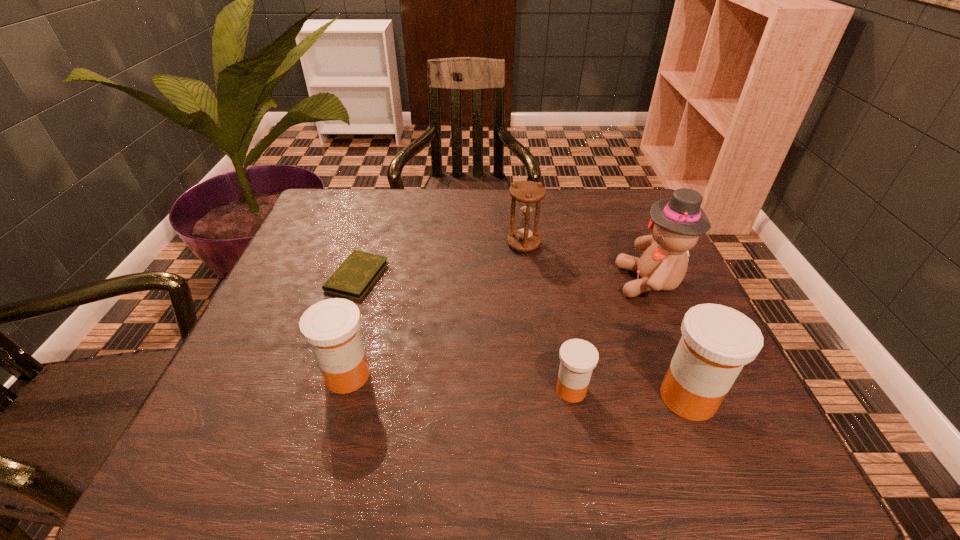
You are a GUI agent. You are given a task and a screenshot of the screen. Output one action in this format:
    pyautogui.click(x=<x>, y=<y>)
    Task: Click on the vacant space that's between the second medicine from left to right and the farthest object
    Image resolution: width=960 pixels, height=540 pixels.
    Given the screenshot: What is the action you would take?
    pyautogui.click(x=547, y=317)

You are a GUI agent. You are given a task and a screenshot of the screen. Output one action in this format:
    pyautogui.click(x=<x>, y=<y>)
    Task: Click on the free spot between the rightmost medicine and the diary
    This screenshot has width=960, height=540.
    Given the screenshot: What is the action you would take?
    pyautogui.click(x=522, y=337)

Where is `free space between the tallest object and the diary`? This screenshot has height=540, width=960. free space between the tallest object and the diary is located at coordinates (504, 279).

This screenshot has height=540, width=960. In order to click on free space between the farthest object and the tallest object in this screenshot , I will do `click(587, 263)`.

The height and width of the screenshot is (540, 960). Identify the location of free spot between the rightmost medicine and the hourglass. (606, 321).

This screenshot has width=960, height=540. In order to click on empty location between the second tallest medicine and the rag_doll in this screenshot , I will do `click(499, 328)`.

This screenshot has height=540, width=960. I want to click on free space between the rightmost medicine and the second tallest medicine, so click(517, 386).

Image resolution: width=960 pixels, height=540 pixels. Find the location of `unoccupied position between the shortest medicine and the farthest object`. unoccupied position between the shortest medicine and the farthest object is located at coordinates (547, 317).

Where is `empty space between the rag_doll and the rightmost medicine`? The image size is (960, 540). empty space between the rag_doll and the rightmost medicine is located at coordinates (669, 340).

Identify the location of vacant area that lies between the diary and the hourglass. The image size is (960, 540). [x=441, y=260].